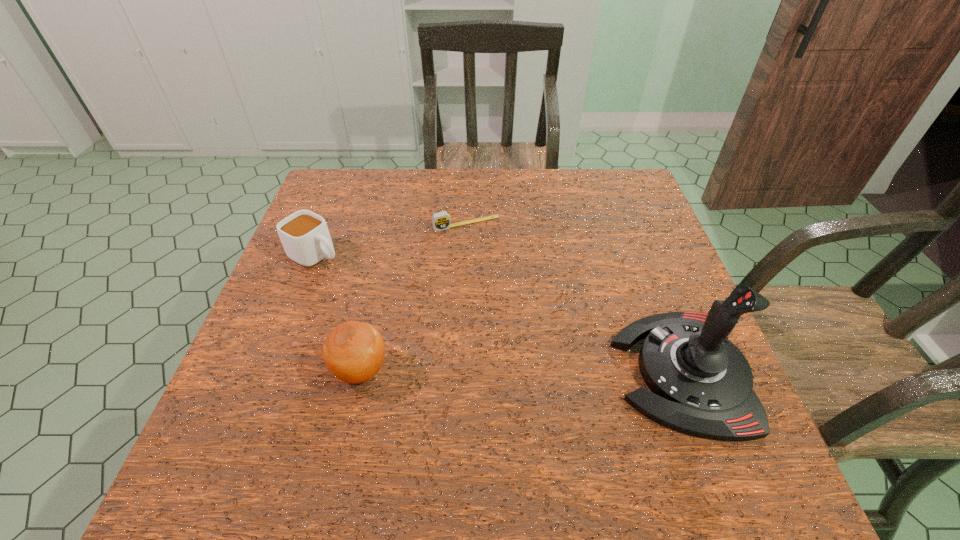
The image size is (960, 540). Find the location of `vacant spot on the desktop that is between the third shortest object and the joystick and is positioned at the front of the second object from right to left with the tape extended`. vacant spot on the desktop that is between the third shortest object and the joystick and is positioned at the front of the second object from right to left with the tape extended is located at coordinates (541, 372).

Where is `vacant spot on the desktop that is between the third object from right to left and the joystick and is positioned on the side with the handle of the cup`? This screenshot has width=960, height=540. vacant spot on the desktop that is between the third object from right to left and the joystick and is positioned on the side with the handle of the cup is located at coordinates (528, 372).